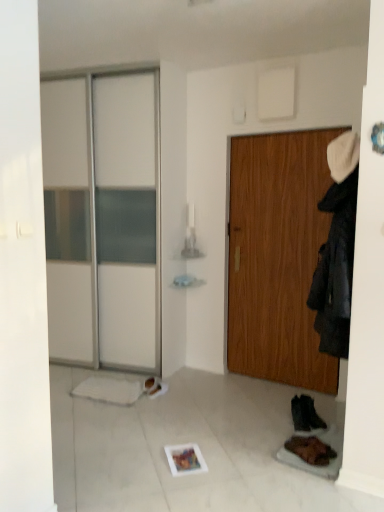
Locate an element on the screen. This screenshot has height=512, width=384. space that is in front of brown leather boot at lower right, the 2th footwear in the back-to-front sequence is located at coordinates (312, 467).